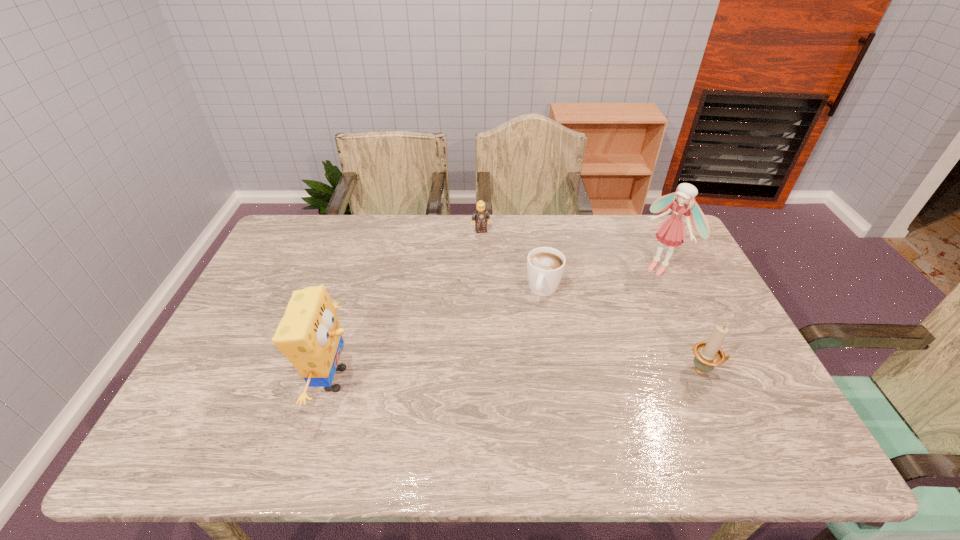
I want to click on the leftmost object, so click(x=309, y=334).

Identify the location of sponge. pyautogui.click(x=309, y=334).

The image size is (960, 540). What are the coordinates of `candle_holder` in the screenshot? It's located at (708, 354).

Locate an element on the screen. This screenshot has width=960, height=540. doll is located at coordinates (671, 232).

The height and width of the screenshot is (540, 960). I want to click on cappuccino, so click(x=545, y=265).

The image size is (960, 540). I want to click on the farthest object, so click(x=481, y=215).

Where is `Lego`? Lego is located at coordinates (481, 215).

This screenshot has height=540, width=960. What are the coordinates of `vacant space located 0.200m on the face of the second tallest object` in the screenshot? It's located at (440, 379).

Where is `vacant space located on the front-facing side of the tallest object`? The width and height of the screenshot is (960, 540). vacant space located on the front-facing side of the tallest object is located at coordinates (606, 308).

Identify the location of free space located 0.210m on the front-facing side of the tallest object. (606, 308).